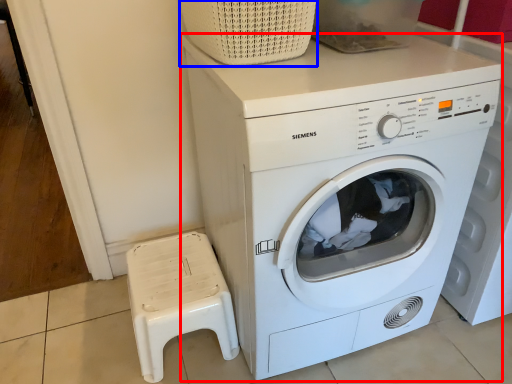
Question: Which of the following is the closest to the observer, washing machine (highlighted by a red box) or basket (highlighted by a blue box)?

Choices:
 (A) washing machine
 (B) basket

Answer: (A)